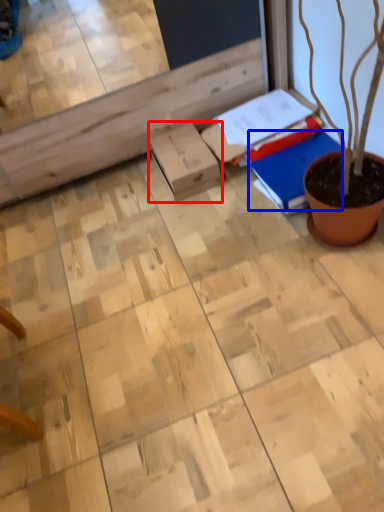
Question: Among these objects, which one is nearest to the camera, cardboard box (highlighted by a red box) or notebook (highlighted by a blue box)?

Choices:
 (A) cardboard box
 (B) notebook

Answer: (B)